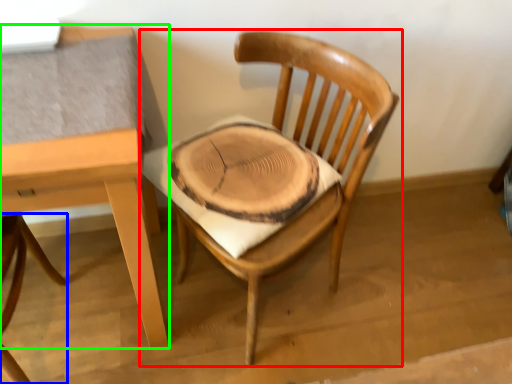
Question: Which is nearer to the chair (highlighted by a red box)? chair (highlighted by a blue box) or table (highlighted by a green box).

Choices:
 (A) chair
 (B) table

Answer: (B)